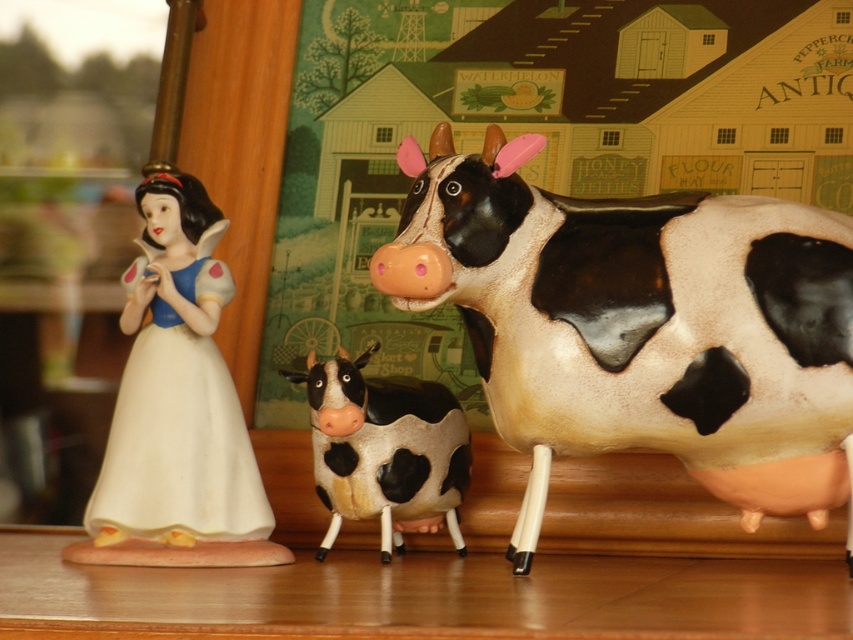
You are standing in front of a display featuring a Snow White figurine and a black and white glossy cow at right. If you want to take a closer look at the cow without moving your head, which object should you lean toward?

You should lean toward the black and white glossy cow at right because it is farther away from you at 3.74 feet compared to the Snow White figurine, so moving closer to it would require leaning in that direction.

You are standing in front of the wooden surface with Snow White and the cows. You want to place a small vase exactly at the point marked as point (676, 449). If your hand is 1.3 meters away from the surface, will you be able to reach the point without moving closer?

The distance of point (676, 449) from the camera is 1.20 meters. Since your hand is 1.3 meters away from the surface, you are slightly farther than the required distance. Therefore, you need to move closer by approximately 0.1 meters to reach the point.